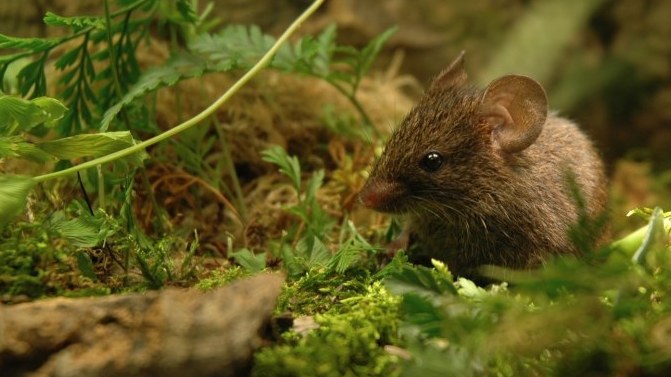
Where is `mouse`? mouse is located at coordinates (496, 209).